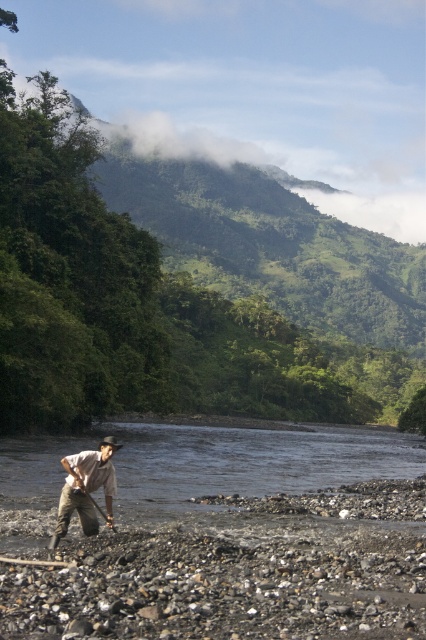
You are a hiker who wants to know if the shiny metallic shovel at lower center is visible under the light brown cotton shirt at lower left. Based on the scene, can you confirm if the shovel is partially or fully obscured by the shirt?

The light brown cotton shirt at lower left is positioned over the shiny metallic shovel at lower center, so the shovel is fully or partially obscured by the shirt.

You are a hiker who wants to know if the light brown cotton shirt at lower left is taller than the shiny metallic shovel at lower center. Can you tell me which one is taller?

The light brown cotton shirt at lower left has a greater height compared to the shiny metallic shovel at lower center, so the light brown cotton shirt at lower left is taller.